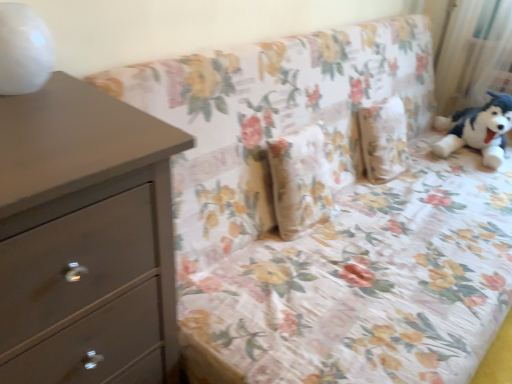
The image size is (512, 384). What do you see at coordinates (85, 239) in the screenshot?
I see `matte gray chest of drawers at left` at bounding box center [85, 239].

Locate an element on the screen. matte gray chest of drawers at left is located at coordinates [85, 239].

This screenshot has width=512, height=384. In order to click on white sheer curtain at upper right in this screenshot , I will do `click(474, 54)`.

Describe the element at coordinates (474, 54) in the screenshot. The width and height of the screenshot is (512, 384). I see `white sheer curtain at upper right` at that location.

What is the approximate width of white sheer curtain at upper right?

white sheer curtain at upper right is 6.34 inches in width.

At what (x,y) coordinates should I click in order to perform the action: click on matte gray chest of drawers at left. Please return your answer as a coordinate pair (x, y). Image resolution: width=512 pixels, height=384 pixels. Looking at the image, I should click on (85, 239).

Looking at this image, is white sheer curtain at upper right to the left or to the right of matte gray chest of drawers at left in the image?

white sheer curtain at upper right is positioned on matte gray chest of drawers at left's right side.

Is white sheer curtain at upper right positioned behind matte gray chest of drawers at left?

Yes, it is behind matte gray chest of drawers at left.

Considering the points (496, 8) and (24, 366), which point is in front, point (496, 8) or point (24, 366)?

The point (24, 366) is closer to the camera.

From the image's perspective, between white sheer curtain at upper right and matte gray chest of drawers at left, who is located below?

matte gray chest of drawers at left, from the image's perspective.

From a real-world perspective, which is physically above, white sheer curtain at upper right or matte gray chest of drawers at left?

white sheer curtain at upper right is physically above.

Considering the relative sizes of white sheer curtain at upper right and matte gray chest of drawers at left in the image provided, is white sheer curtain at upper right thinner than matte gray chest of drawers at left?

Yes, white sheer curtain at upper right is thinner than matte gray chest of drawers at left.

Which of these two, white sheer curtain at upper right or matte gray chest of drawers at left, stands taller?

matte gray chest of drawers at left is taller.

Does white sheer curtain at upper right have a smaller size compared to matte gray chest of drawers at left?

Yes.

Is matte gray chest of drawers at left inside white sheer curtain at upper right?

Actually, matte gray chest of drawers at left is outside white sheer curtain at upper right.

Is white sheer curtain at upper right not near matte gray chest of drawers at left?

Indeed, white sheer curtain at upper right is not near matte gray chest of drawers at left.

Is white sheer curtain at upper right looking in the opposite direction of matte gray chest of drawers at left?

No, matte gray chest of drawers at left is not at the back of white sheer curtain at upper right.

How much distance is there between white sheer curtain at upper right and matte gray chest of drawers at left?

white sheer curtain at upper right is 7.45 feet away from matte gray chest of drawers at left.

At what (x,y) coordinates should I click in order to perform the action: click on curtain that appears above the matte gray chest of drawers at left (from a real-world perspective). Please return your answer as a coordinate pair (x, y). Image resolution: width=512 pixels, height=384 pixels. Looking at the image, I should click on (474, 54).

Between matte gray chest of drawers at left and white sheer curtain at upper right, which one appears on the right side from the viewer's perspective?

white sheer curtain at upper right is more to the right.

Between matte gray chest of drawers at left and white sheer curtain at upper right, which one is positioned in front?

Positioned in front is matte gray chest of drawers at left.

Does point (93, 158) come in front of point (463, 69)?

Yes, point (93, 158) is closer to viewer.

From the image's perspective, which is above, matte gray chest of drawers at left or white sheer curtain at upper right?

white sheer curtain at upper right is shown above in the image.

From a real-world perspective, is matte gray chest of drawers at left positioned under white sheer curtain at upper right based on gravity?

Indeed, from a real-world perspective, matte gray chest of drawers at left is positioned beneath white sheer curtain at upper right.

Does matte gray chest of drawers at left have a greater width compared to white sheer curtain at upper right?

Yes.

Considering the relative sizes of matte gray chest of drawers at left and white sheer curtain at upper right in the image provided, is matte gray chest of drawers at left taller than white sheer curtain at upper right?

Yes, matte gray chest of drawers at left is taller than white sheer curtain at upper right.

Considering the relative sizes of matte gray chest of drawers at left and white sheer curtain at upper right in the image provided, is matte gray chest of drawers at left smaller than white sheer curtain at upper right?

No, matte gray chest of drawers at left is not smaller than white sheer curtain at upper right.

Looking at this image, is white sheer curtain at upper right a part of matte gray chest of drawers at left?

That's incorrect, white sheer curtain at upper right is not inside matte gray chest of drawers at left.

Is matte gray chest of drawers at left far from white sheer curtain at upper right?

matte gray chest of drawers at left is far away from white sheer curtain at upper right.

Is white sheer curtain at upper right at the back of matte gray chest of drawers at left?

matte gray chest of drawers at left is not turned away from white sheer curtain at upper right.

Find the location of a particular element. This screenshot has height=384, width=512. the chest of drawers directly beneath the white sheer curtain at upper right (from a real-world perspective) is located at coordinates (85, 239).

The width and height of the screenshot is (512, 384). In the image, there is a matte gray chest of drawers at left. What are the coordinates of `curtain above it (from the image's perspective)` in the screenshot? It's located at (474, 54).

Identify the location of the chest of drawers below the white sheer curtain at upper right (from a real-world perspective). (85, 239).